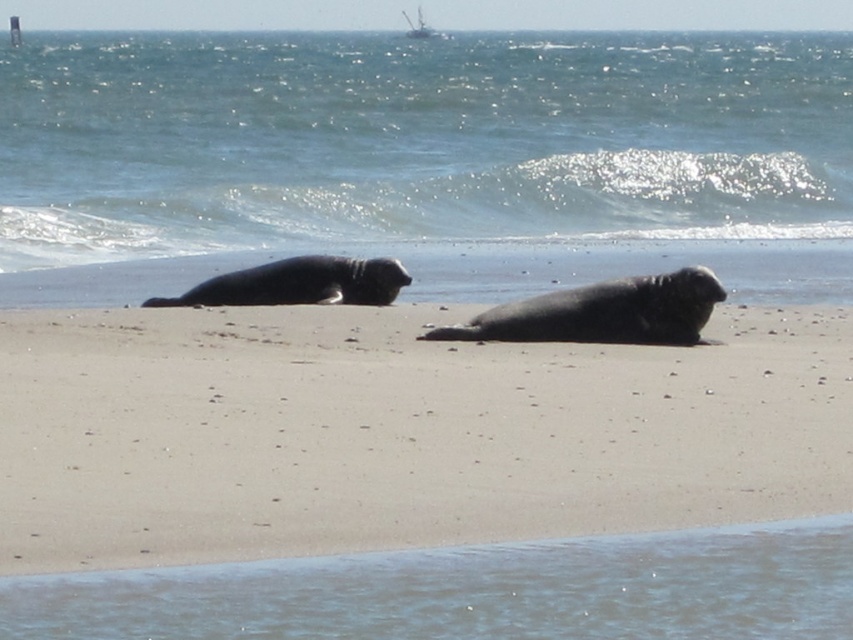
You are standing at the point marked as point (416, 140) on the beach. What object is exactly at your current location?

The blue water at upper center is exactly at point (416, 140).

You are standing on the beach and want to walk towards the gray fur seal at center. Will you pass by the blue water at upper center before reaching the seal?

Yes, you will pass by the blue water at upper center before reaching the gray fur seal at center because the blue water at upper center is closer to you than the seal.